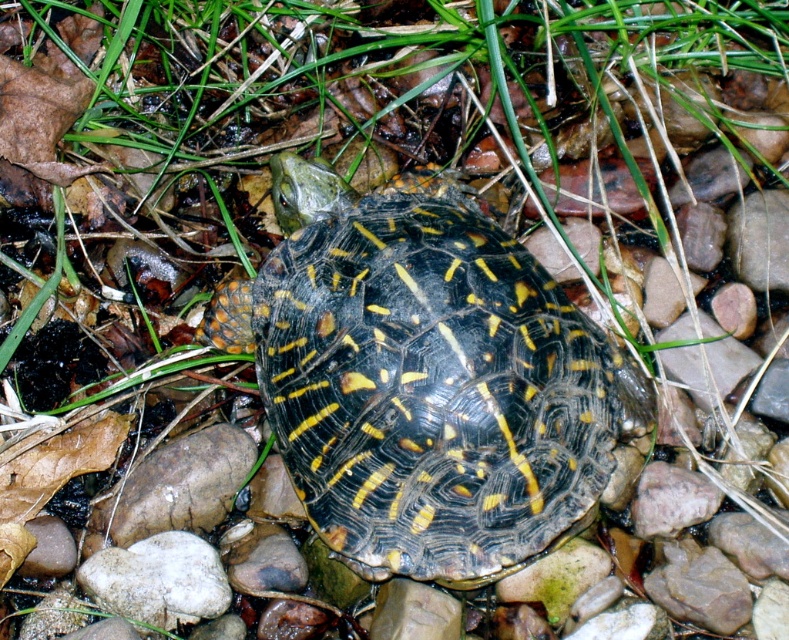
Based on the photo, can you confirm if yellow-patterned shell at center is positioned above smooth gray rock at center?

Correct, yellow-patterned shell at center is located above smooth gray rock at center.

Between yellow-patterned shell at center and smooth gray rock at center, which one appears on the right side from the viewer's perspective?

yellow-patterned shell at center is more to the right.

Is point (453, 516) in front of point (141, 461)?

Yes, it is.

This screenshot has height=640, width=789. In order to click on yellow-patterned shell at center in this screenshot , I will do `click(425, 378)`.